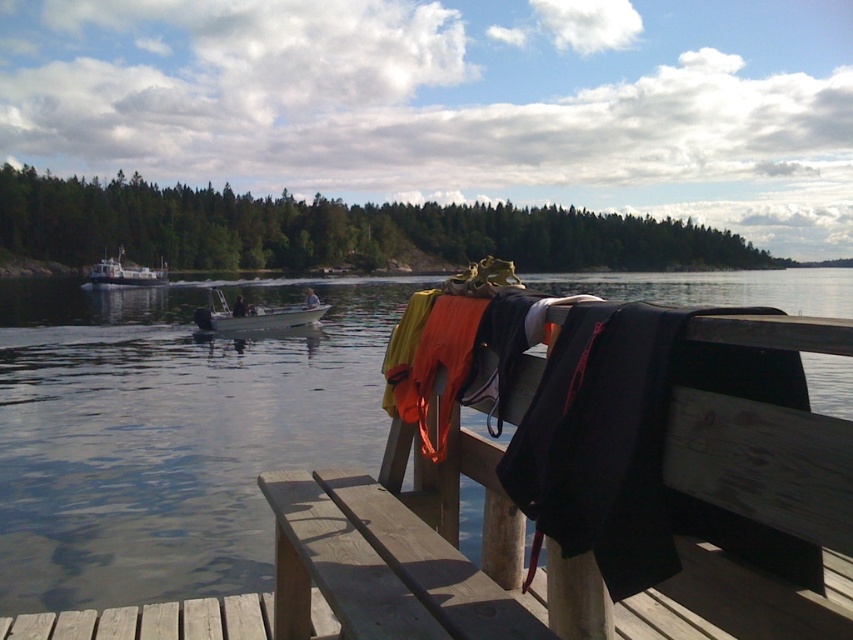
Question: Which of the following is the farthest from the observer?

Choices:
 (A) (120, 282)
 (B) (254, 321)

Answer: (A)

Question: Considering the relative positions of orange life vest at center and white plastic boat at center in the image provided, where is orange life vest at center located with respect to white plastic boat at center?

Choices:
 (A) below
 (B) above

Answer: (A)

Question: Can you confirm if smooth water at dock center is bigger than orange life vest at center?

Choices:
 (A) no
 (B) yes

Answer: (B)

Question: Which point is closer to the camera?

Choices:
 (A) orange life vest at center
 (B) white plastic boat at center
 (C) smooth water at dock center

Answer: (A)

Question: Is orange life vest at center to the left of white plastic boat at center from the viewer's perspective?

Choices:
 (A) no
 (B) yes

Answer: (A)

Question: Among these objects, which one is farthest from the camera?

Choices:
 (A) white plastic boat at left
 (B) orange life vest at center

Answer: (A)